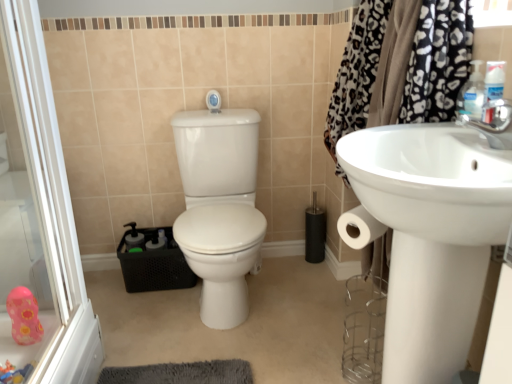
Where is `empty space that is to the right of white glossy shower at upper center`? The width and height of the screenshot is (512, 384). empty space that is to the right of white glossy shower at upper center is located at coordinates (233, 109).